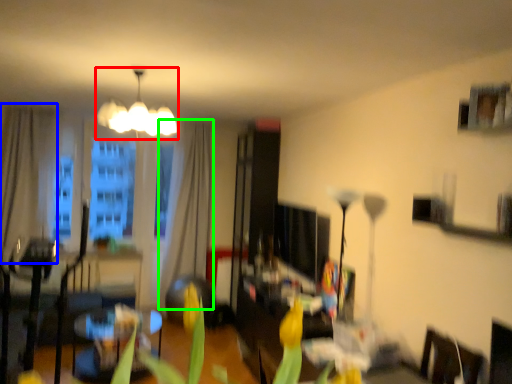
Question: Which is nearer to the lamp (highlighted by a red box)? curtain (highlighted by a blue box) or curtain (highlighted by a green box).

Choices:
 (A) curtain
 (B) curtain

Answer: (B)